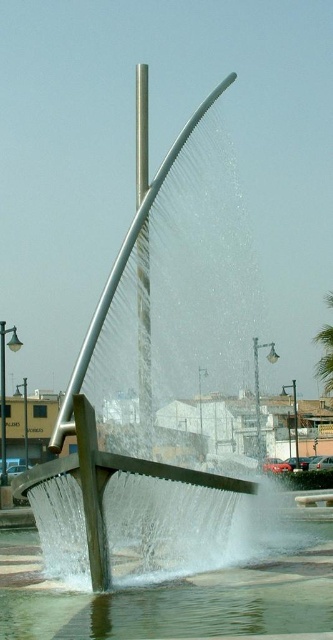
You are a photographer standing in front of the fountain. You want to capture a photo that includes both the clear water at base center and the green leafy palm tree at upper right. Based on their positions, will the palm tree appear in the background or foreground of the photo?

The green leafy palm tree at upper right is above the clear water at base center, so it will appear in the background of the photo.

You are standing in front of the fountain and want to take a photo of the green leafy palm tree at upper right without the clear water at base center blocking the view. Is this possible?

The clear water at base center is closer to the viewer than the green leafy palm tree at upper right, so the water will block the view of the palm tree. You cannot take a photo of the green leafy palm tree at upper right without the clear water at base center blocking the view.